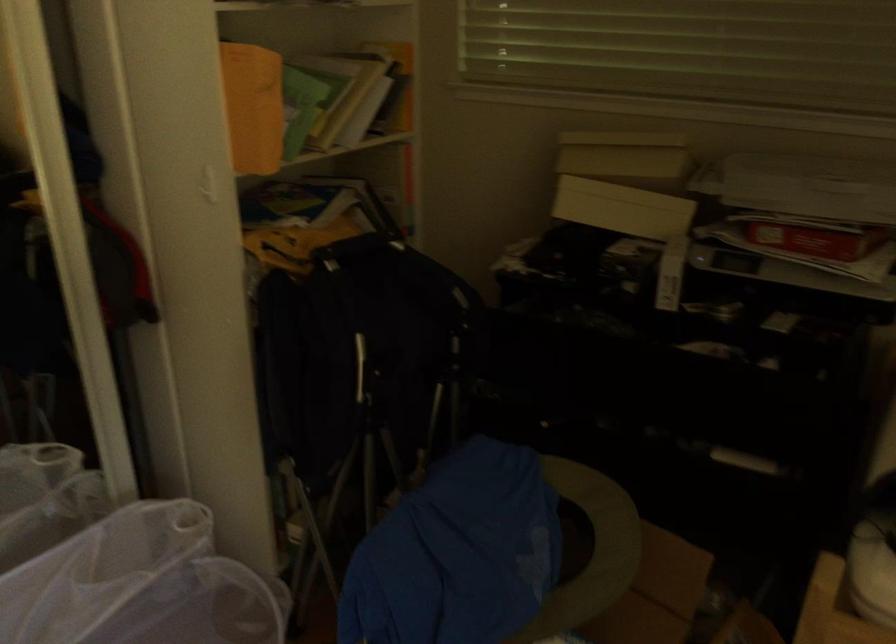
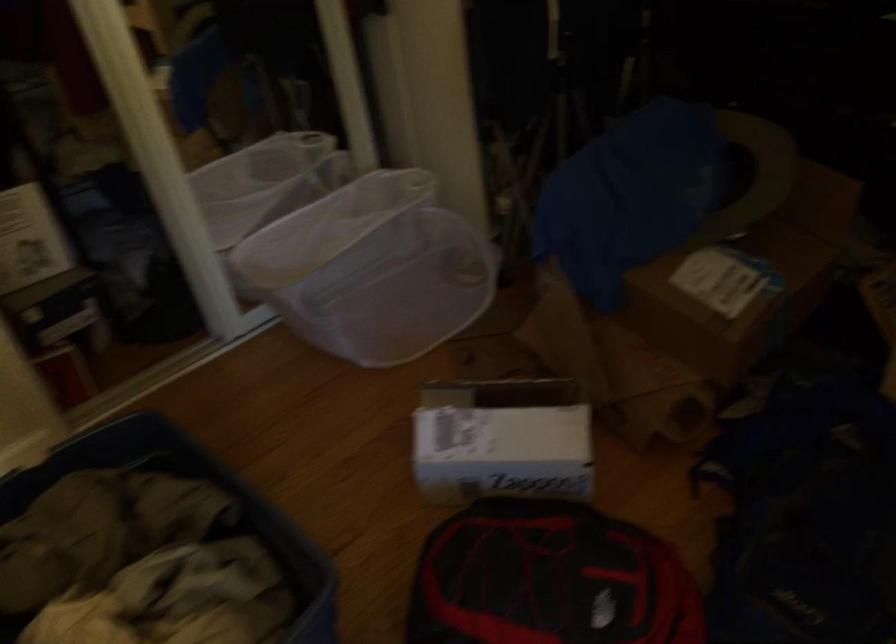
Question: In a continuous first-person perspective shot, in which direction is the camera moving?

Choices:
 (A) Left
 (B) Right
 (C) Forward
 (D) Backward

Answer: (D)